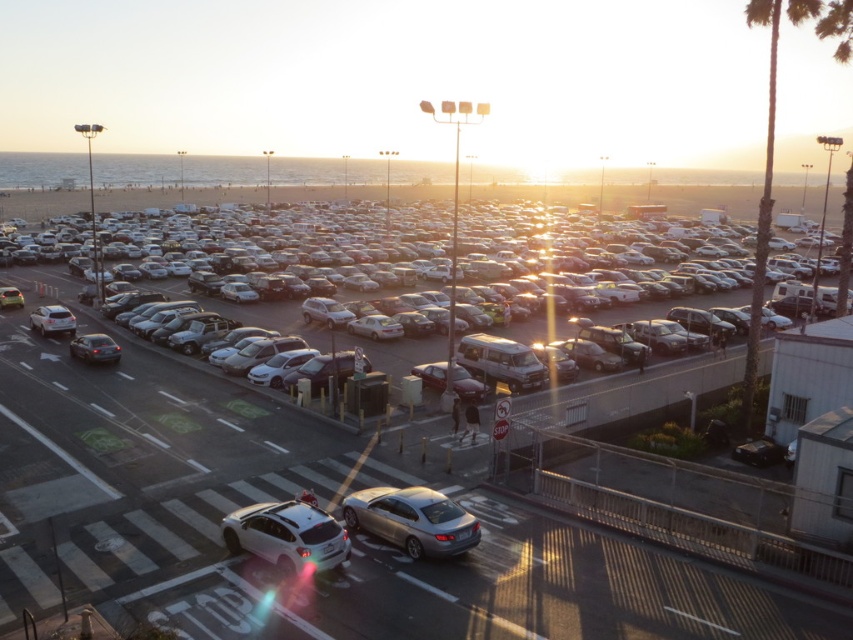
Question: Estimate the real-world distances between objects in this image. Which object is closer to the silver metallic sedan at center?

Choices:
 (A) metallic silver cars at center
 (B) white matte hatchback at center

Answer: (A)

Question: Among these objects, which one is farthest from the camera?

Choices:
 (A) satin silver sedan at center
 (B) white matte hatchback at center
 (C) silver metallic sedan at center
 (D) shiny silver sedan at lower left

Answer: (D)

Question: Is metallic silver cars at center closer to the viewer compared to silver metallic sedan at left?

Choices:
 (A) no
 (B) yes

Answer: (B)

Question: Does metallic silver cars at center appear under satin silver sedan at center?

Choices:
 (A) yes
 (B) no

Answer: (B)

Question: Does metallic silver cars at center lie behind shiny silver sedan at lower left?

Choices:
 (A) no
 (B) yes

Answer: (A)

Question: Which point is farther from the camera taking this photo?

Choices:
 (A) (76, 352)
 (B) (413, 524)
 (C) (590, 260)
 (D) (67, 333)

Answer: (C)